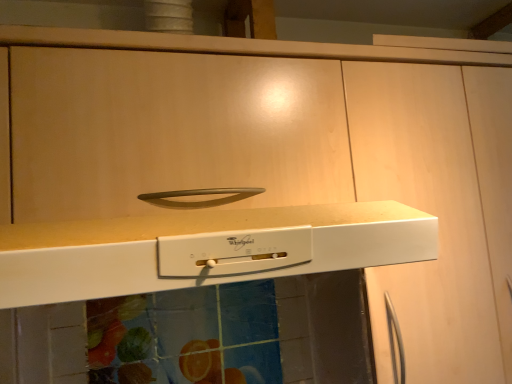
Describe the element at coordinates (204, 249) in the screenshot. Image resolution: width=512 pixels, height=384 pixels. I see `white matte countertop at center` at that location.

Find the location of a particular element. Image resolution: width=512 pixels, height=384 pixels. white matte countertop at center is located at coordinates point(204,249).

The image size is (512, 384). I want to click on white matte countertop at center, so click(x=204, y=249).